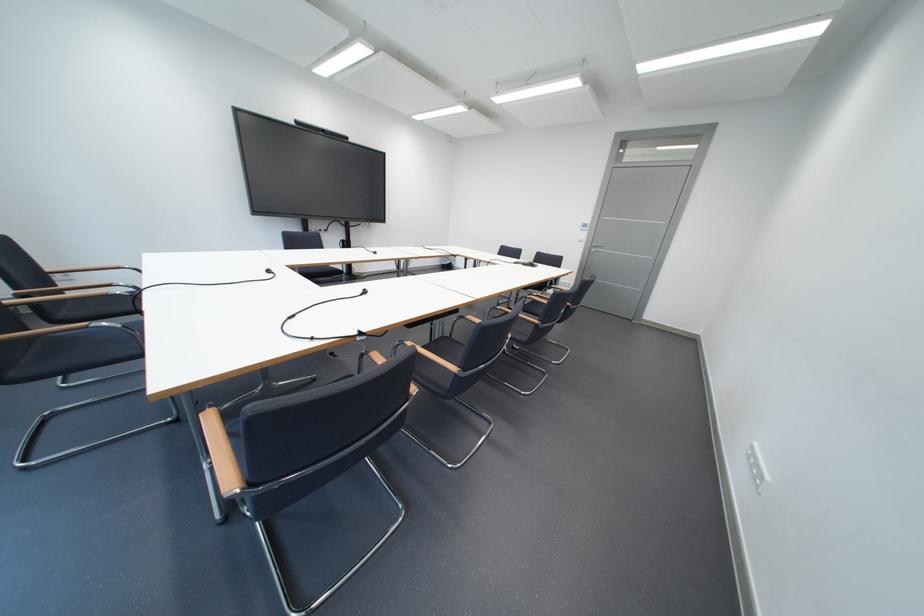
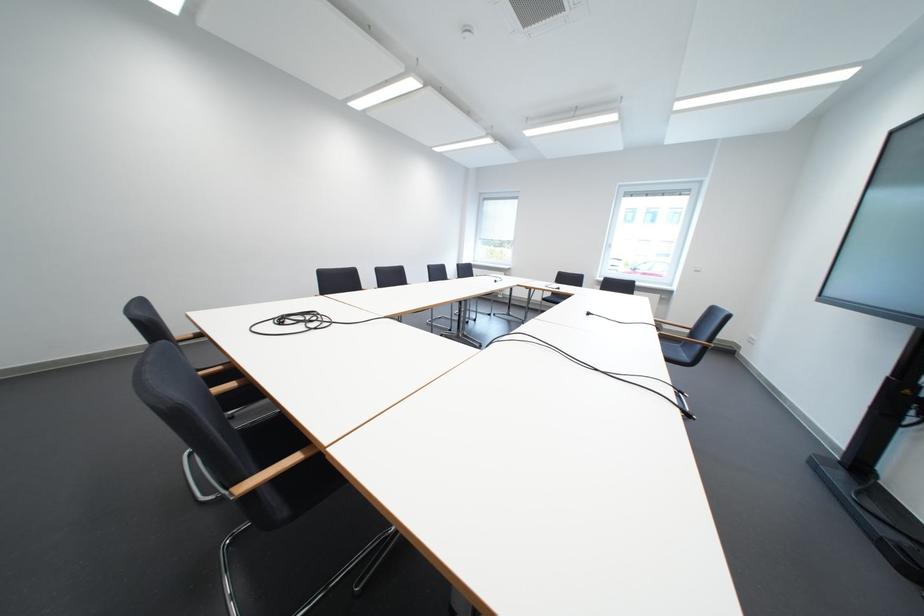
Locate, in the second image, the point that corresponds to the point at 387,254 in the first image.

(601, 315)